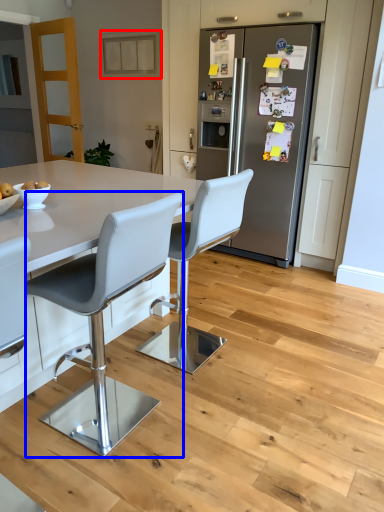
Question: Which object appears farthest to the camera in this image, cabinetry (highlighted by a red box) or chair (highlighted by a blue box)?

Choices:
 (A) cabinetry
 (B) chair

Answer: (A)